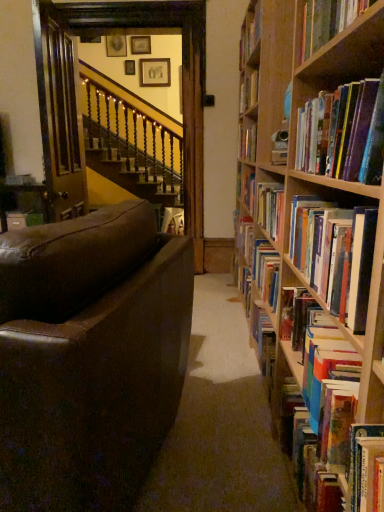
Question: Relative to hardcover book at upper right, arranged as the 2th book when viewed from the front, is wooden picture frame at upper center, which ranks as the second picture frame in left-to-right order, in front or behind?

Choices:
 (A) behind
 (B) front

Answer: (A)

Question: Is wooden picture frame at upper center, which ranks as the second picture frame in left-to-right order, bigger or smaller than hardcover book at upper right, arranged as the 2th book when viewed from the front?

Choices:
 (A) big
 (B) small

Answer: (B)

Question: Which is farther from the hardcover book at center, the second book when ordered from back to front?

Choices:
 (A) brown leather couch at left
 (B) wooden picture frame at upper center, the 1th picture frame from the right
 (C) hardcover book at right, placed as the 3th book when sorted from back to front
 (D) hardcover book at upper right, arranged as the 2th book when viewed from the front
 (E) wooden picture frame at upper center, which ranks as the second picture frame in left-to-right order

Answer: (E)

Question: Which of these objects is positioned closest to the hardcover books at right, the third book positioned from the front?

Choices:
 (A) wooden picture frame at upper center, the first picture frame in the left-to-right sequence
 (B) wooden picture frame at upper center, which ranks as the second picture frame in left-to-right order
 (C) hardcover book at center, the first book in the back-to-front sequence
 (D) matte white book at center
 (E) hardcover book at upper right, the 5th book when ordered from back to front

Answer: (E)